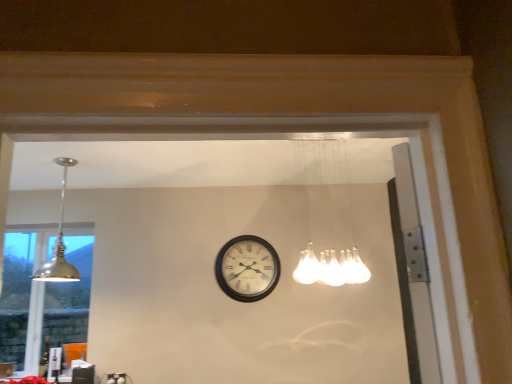
Question: In which direction should I rotate to look at white frosted glass light fixture at upper center, which appears as the 2th lamp when viewed from the left?

Choices:
 (A) left
 (B) right

Answer: (B)

Question: Does black wooden clock at center have a greater width compared to matte silver lampshade at left?

Choices:
 (A) yes
 (B) no

Answer: (A)

Question: From the image's perspective, is black wooden clock at center on matte silver lampshade at left?

Choices:
 (A) yes
 (B) no

Answer: (A)

Question: Is black wooden clock at center far away from matte silver lampshade at left?

Choices:
 (A) yes
 (B) no

Answer: (A)

Question: From a real-world perspective, is black wooden clock at center on matte silver lampshade at left?

Choices:
 (A) no
 (B) yes

Answer: (B)

Question: Does black wooden clock at center come behind matte silver lampshade at left?

Choices:
 (A) no
 (B) yes

Answer: (A)

Question: Considering the relative positions of black wooden clock at center and matte silver lampshade at left in the image provided, is black wooden clock at center to the right of matte silver lampshade at left from the viewer's perspective?

Choices:
 (A) no
 (B) yes

Answer: (B)

Question: Is the surface of matte silver lampshade at left in direct contact with white frosted glass light fixture at upper center, which appears as the 2th lamp when viewed from the left?

Choices:
 (A) no
 (B) yes

Answer: (A)

Question: Is matte silver lampshade at left turned away from white frosted glass light fixture at upper center, arranged as the 1th lamp when viewed from the right?

Choices:
 (A) no
 (B) yes

Answer: (A)

Question: Is matte silver lampshade at left bigger than white frosted glass light fixture at upper center, which appears as the 2th lamp when viewed from the left?

Choices:
 (A) no
 (B) yes

Answer: (A)

Question: Is matte silver lampshade at left far away from white frosted glass light fixture at upper center, which appears as the 2th lamp when viewed from the left?

Choices:
 (A) no
 (B) yes

Answer: (B)

Question: Can you confirm if matte silver lampshade at left is wider than white frosted glass light fixture at upper center, arranged as the 1th lamp when viewed from the right?

Choices:
 (A) yes
 (B) no

Answer: (B)

Question: From a real-world perspective, is matte silver lampshade at left positioned over white frosted glass light fixture at upper center, which appears as the 2th lamp when viewed from the left, based on gravity?

Choices:
 (A) yes
 (B) no

Answer: (B)

Question: Can you see matte silver lampshade at left touching matte silver pendant light at upper left, placed as the second lamp when sorted from right to left?

Choices:
 (A) no
 (B) yes

Answer: (A)